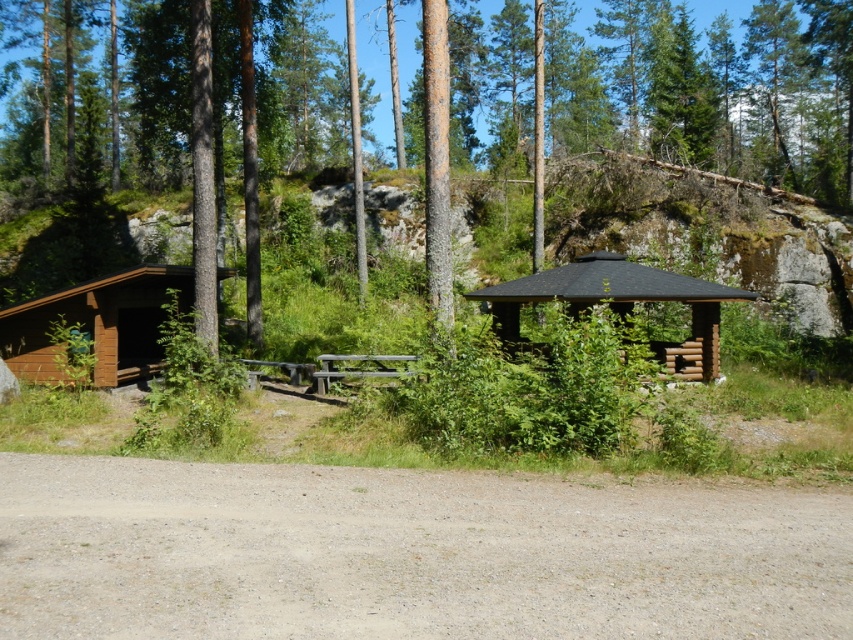
You are standing at the dirt path leading towards the two wooden structures. You want to walk directly to the brown wooden hut at center. Is the brown wood tree at center blocking your path?

The brown wood tree at center is in front of the brown wooden hut at center, so it is blocking your path.

In the scene shown: You are planning to drive a small delivery van that is 2 meters tall. You need to pass through the gray gravel dirt track at lower center to reach the brown wooden hut at center. Will the van fit under the track?

The gray gravel dirt track at lower center is not as tall as brown wooden hut at center, so the height of the track is lower than the hut. Since the van is 2 meters tall, it depends on the actual height of the track. However, since the track is shorter than the hut, it might be too low for the van to pass through safely. Please check the exact height of the track before proceeding.

You are planning to set up a tent in the campsite. The brown wood tree at center and the brown wooden hut at center are both in the area. Which object takes up more space, making it harder to place the tent nearby?

The brown wood tree at center has a larger size compared to the brown wooden hut at center, so it takes up more space and would make it harder to place the tent nearby.